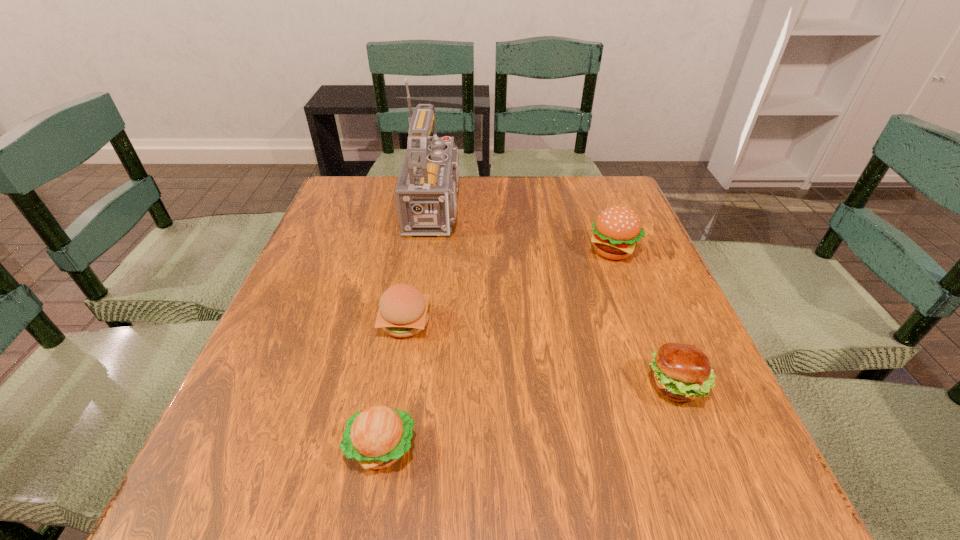
The image size is (960, 540). In order to click on free location located on the right of the nearest object in this screenshot , I will do `click(651, 448)`.

Locate an element on the screen. The height and width of the screenshot is (540, 960). object at the far edge is located at coordinates (426, 192).

This screenshot has width=960, height=540. Identify the location of object that is at the near edge. (376, 437).

At what (x,y) coordinates should I click in order to perform the action: click on free location at the far edge. Please return your answer as a coordinate pair (x, y). Looking at the image, I should click on (555, 178).

Locate an element on the screen. blank area at the near edge is located at coordinates (324, 504).

At what (x,y) coordinates should I click in order to perform the action: click on vacant space at the left edge of the desktop. Please return your answer as a coordinate pair (x, y). The image size is (960, 540). Looking at the image, I should click on (363, 259).

The height and width of the screenshot is (540, 960). In the image, there is a desktop. In order to click on free space at the right edge in this screenshot , I will do `click(640, 253)`.

This screenshot has height=540, width=960. Identify the location of free space at the far left corner of the desktop. (327, 207).

Locate an element on the screen. The width and height of the screenshot is (960, 540). vacant space at the far right corner of the desktop is located at coordinates (567, 184).

Identify the location of free point between the second nearest object and the nearest hamburger. This screenshot has height=540, width=960. (529, 416).